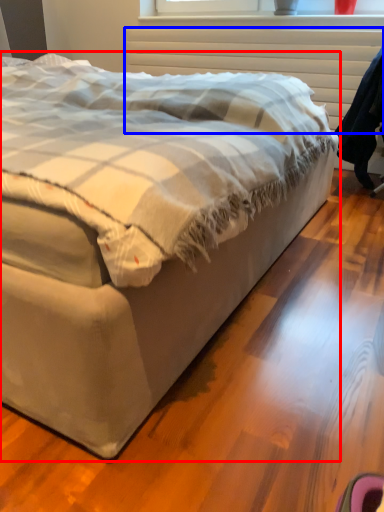
Question: Which point is further to the camera, bed (highlighted by a red box) or radiator (highlighted by a blue box)?

Choices:
 (A) bed
 (B) radiator

Answer: (B)